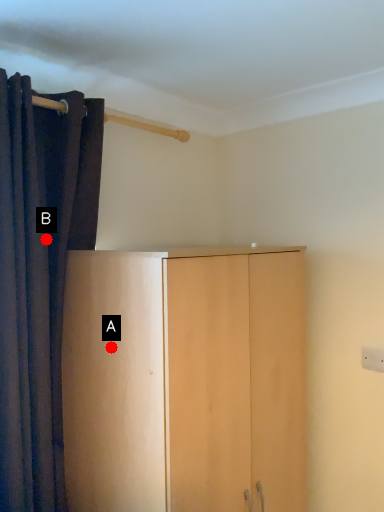
Question: Two points are circled on the image, labeled by A and B beside each circle. Which point appears farthest from the camera in this image?

Choices:
 (A) A is further
 (B) B is further

Answer: (B)